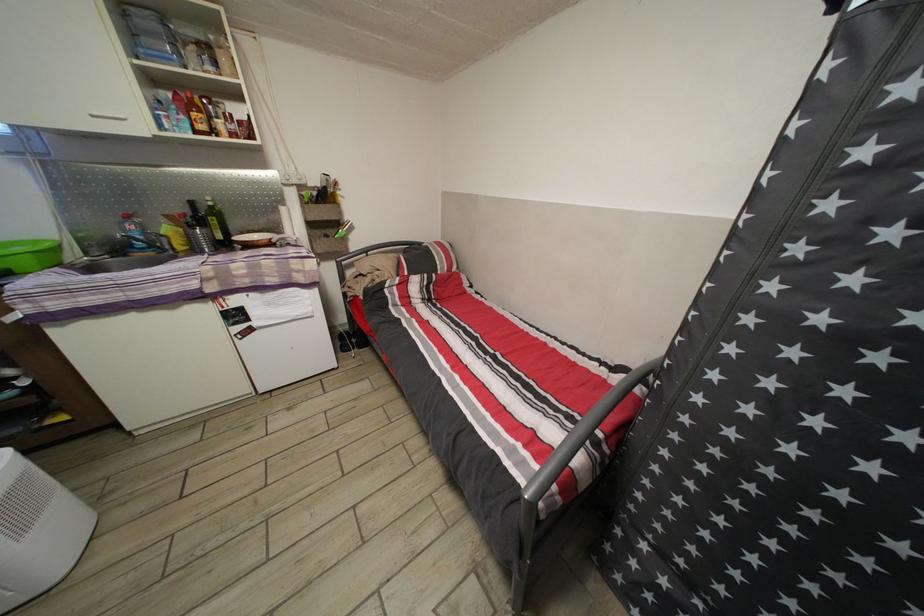
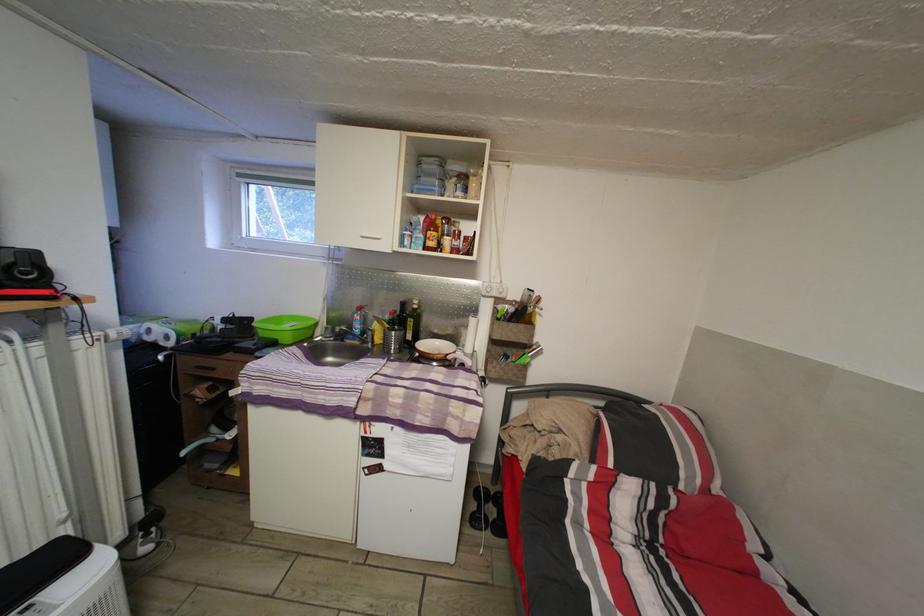
Where in the second image is the point corresponding to (x=220, y=227) from the first image?

(418, 329)